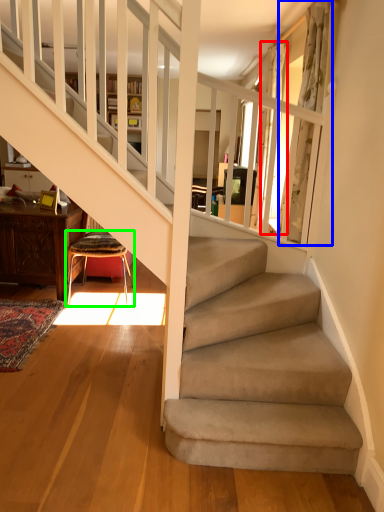
Question: Which object is positioned closest to curtain (highlighted by a red box)? Select from curtain (highlighted by a blue box) and chair (highlighted by a green box).

Choices:
 (A) curtain
 (B) chair

Answer: (A)